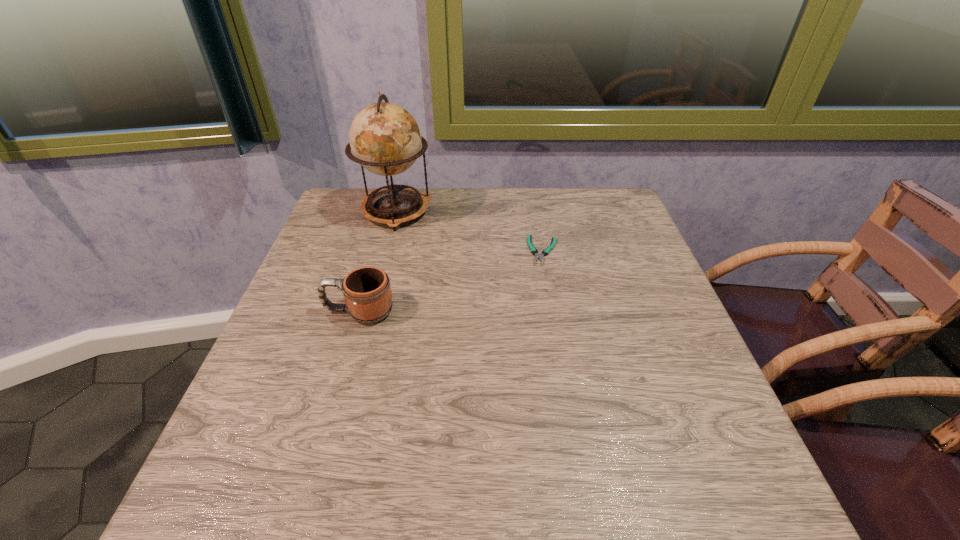
The image size is (960, 540). What are the coordinates of `free location that satisfies the following two spatial constraints: 1. on the front side of the pliers; 2. on the side of the mug with the handle` in the screenshot? It's located at (554, 311).

In order to click on free location that satisfies the following two spatial constraints: 1. at the center of the farthest object; 2. on the side of the nearest object with the handle in this screenshot , I will do `click(370, 311)`.

Identify the location of vacant region that satisfies the following two spatial constraints: 1. at the center of the farthest object; 2. on the side of the nearest object with the handle. The image size is (960, 540). (370, 311).

Where is `free space that satisfies the following two spatial constraints: 1. at the center of the farthest object; 2. on the side of the mug with the handle`? free space that satisfies the following two spatial constraints: 1. at the center of the farthest object; 2. on the side of the mug with the handle is located at coordinates (370, 311).

Where is `vacant region that satisfies the following two spatial constraints: 1. at the center of the farthest object; 2. on the right side of the pliers`? vacant region that satisfies the following two spatial constraints: 1. at the center of the farthest object; 2. on the right side of the pliers is located at coordinates (386, 251).

The width and height of the screenshot is (960, 540). In order to click on vacant point that satisfies the following two spatial constraints: 1. at the center of the tallest object; 2. on the side of the nearest object with the handle in this screenshot , I will do `click(370, 311)`.

Where is `free space that satisfies the following two spatial constraints: 1. at the center of the rightmost object; 2. on the left side of the tallest object`? free space that satisfies the following two spatial constraints: 1. at the center of the rightmost object; 2. on the left side of the tallest object is located at coordinates (386, 251).